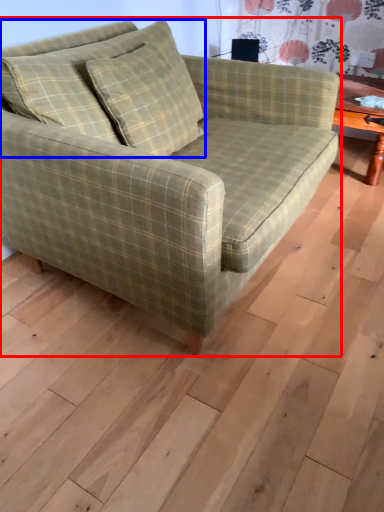
Question: Which object appears closest to the camera in this image, studio couch (highlighted by a red box) or pillow (highlighted by a blue box)?

Choices:
 (A) studio couch
 (B) pillow

Answer: (A)